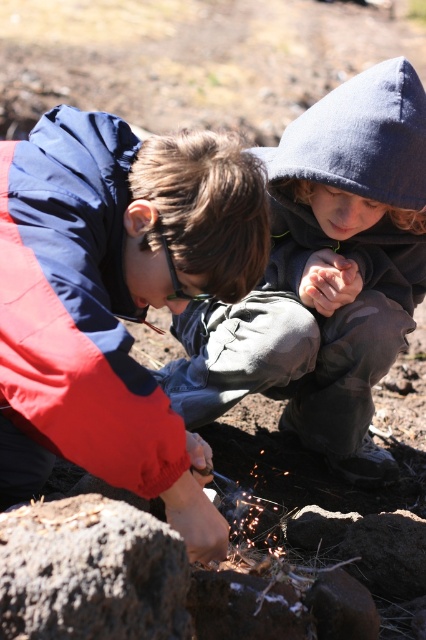
Question: Does brushed metal knife at lower left have a greater width compared to smooth brown rock at center?

Choices:
 (A) no
 (B) yes

Answer: (B)

Question: Is camouflage pants at center wider than smooth brown rock at center?

Choices:
 (A) yes
 (B) no

Answer: (A)

Question: Is camouflage pants at center above rough textured rock at center?

Choices:
 (A) no
 (B) yes

Answer: (B)

Question: Which of these objects is positioned farthest from the smooth brown rock at center?

Choices:
 (A) smooth gray rock at center
 (B) rough textured rock at center
 (C) camouflage pants at center
 (D) brushed metal knife at lower left

Answer: (C)

Question: Considering the real-world distances, which object is farthest from the camouflage pants at center?

Choices:
 (A) rough textured rock at center
 (B) brushed metal knife at lower left
 (C) smooth gray rock at center

Answer: (A)

Question: Among these objects, which one is farthest from the camera?

Choices:
 (A) camouflage pants at center
 (B) smooth brown rock at center
 (C) brushed metal knife at lower left
 (D) smooth gray rock at center

Answer: (D)